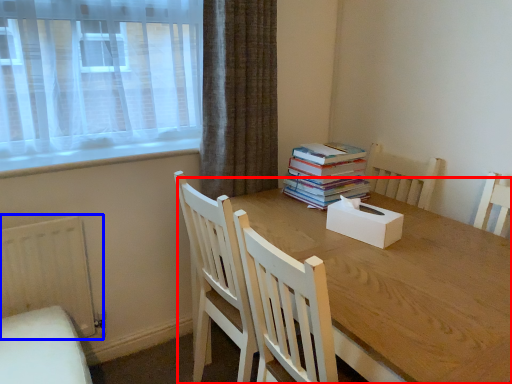
Question: Which point is further to the camera, round table (highlighted by a red box) or radiator (highlighted by a blue box)?

Choices:
 (A) round table
 (B) radiator

Answer: (B)